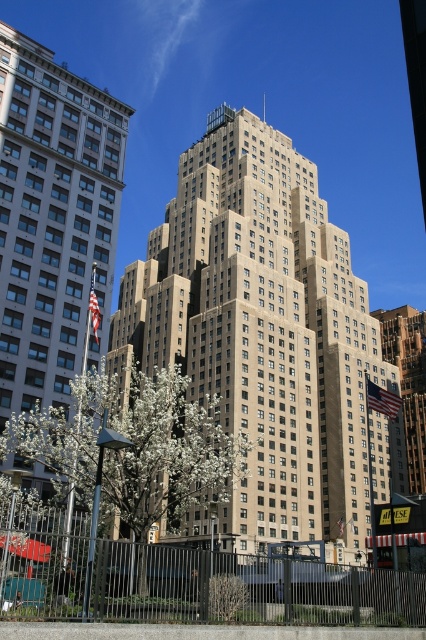
Question: Is white blossoming tree at lower left smaller than gold textured building at center?

Choices:
 (A) no
 (B) yes

Answer: (A)

Question: Is beige stone building at center smaller than gold textured building at center?

Choices:
 (A) yes
 (B) no

Answer: (B)

Question: In this image, where is beige stone building at left located relative to white blossoming tree at lower left?

Choices:
 (A) right
 (B) left

Answer: (B)

Question: Which object is closer to the camera taking this photo?

Choices:
 (A) gold textured building at center
 (B) beige stone building at center

Answer: (B)

Question: Which object is farther from the camera taking this photo?

Choices:
 (A) beige stone building at center
 (B) gold textured building at center
 (C) white blossoming tree at lower left

Answer: (B)

Question: Estimate the real-world distances between objects in this image. Which object is closer to the white blossoming tree at lower left?

Choices:
 (A) beige stone building at center
 (B) gold textured building at center

Answer: (A)